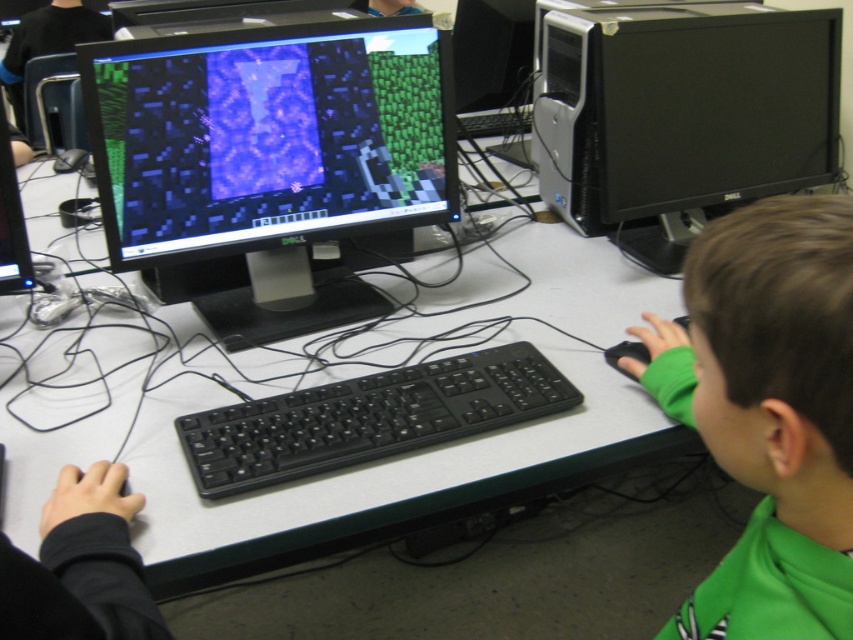
You are a student trying to place your backpack on the desk. The backpack is wider than the black plastic desktop computer at right. Can you fit your backpack on the white plastic table at center without moving the computer?

The white plastic table at center is wider than the black plastic desktop computer at right, so yes, the backpack can fit on the white plastic table at center as long as it is placed in the remaining space not occupied by the computer.

Looking at this image, you are a student who wants to place a textbook on the white plastic table at center. However, there is a black plastic desktop computer at right nearby. Is the table located below the computer?

The white plastic table at center is positioned under the black plastic desktop computer at right, so yes, the table is located below the computer.

Consider the image. You are a student in the classroom and want to reach the black plastic desktop computer at right. If you are standing at the origin point of the coordinate system, which is the bottom left corner of the desk, can you estimate how far you need to walk to reach it?

The black plastic desktop computer at right is located at coordinate point (682, 113). Assuming the desk is a standard size, you would need to walk approximately 0.178 meters to the right and 0.801 meters forward to reach it.